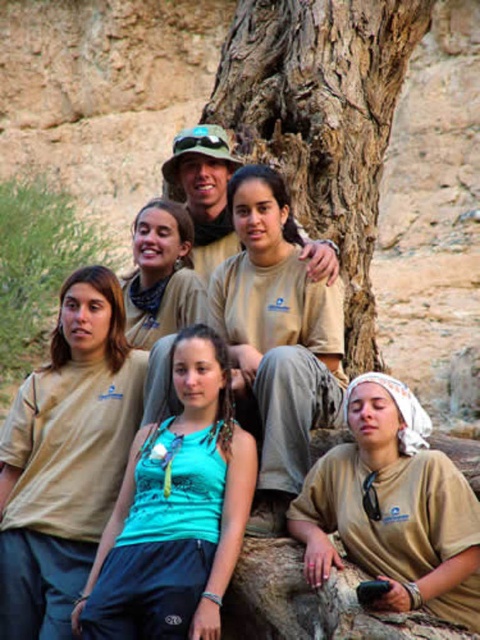
Question: Which point is farther from the camera taking this photo?

Choices:
 (A) tap(94, 564)
 (B) tap(285, 3)
 (C) tap(279, 413)

Answer: (B)

Question: Does beige cotton shirt at center have a larger size compared to matte khaki shirt at center?

Choices:
 (A) yes
 (B) no

Answer: (A)

Question: In this image, where is teal fabric tank top at center located relative to matte khaki shirt at center?

Choices:
 (A) above
 (B) below

Answer: (B)

Question: Can you confirm if brown rough bark tree at center is positioned to the right of matte khaki shirt at center?

Choices:
 (A) no
 (B) yes

Answer: (B)

Question: Estimate the real-world distances between objects in this image. Which object is closer to the brown rough bark tree at center?

Choices:
 (A) teal fabric tank top at center
 (B) matte khaki shirt at center

Answer: (B)

Question: Which object is positioned closest to the matte khaki shirt at center?

Choices:
 (A) matte khaki t-shirt at center
 (B) brown rough bark tree at center
 (C) teal fabric tank top at center

Answer: (A)